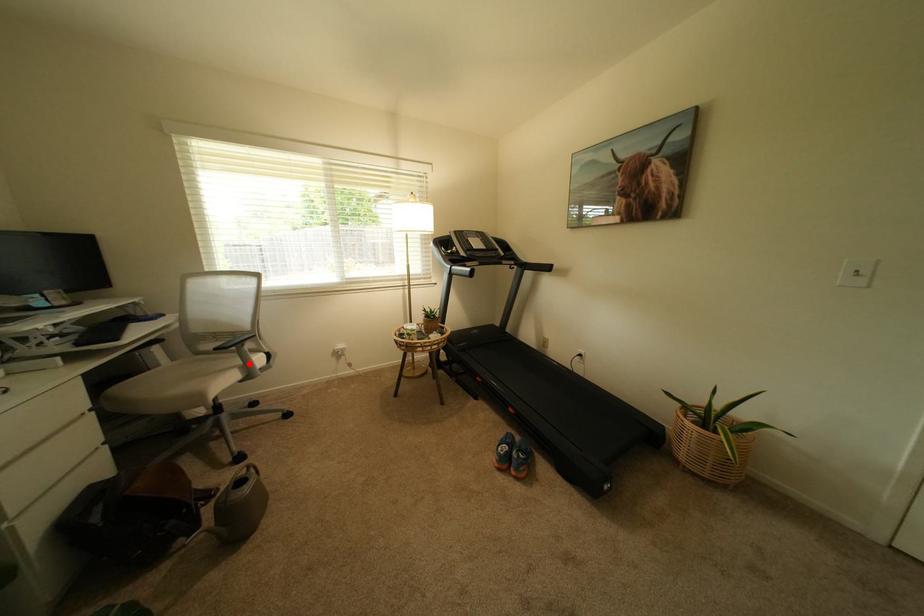
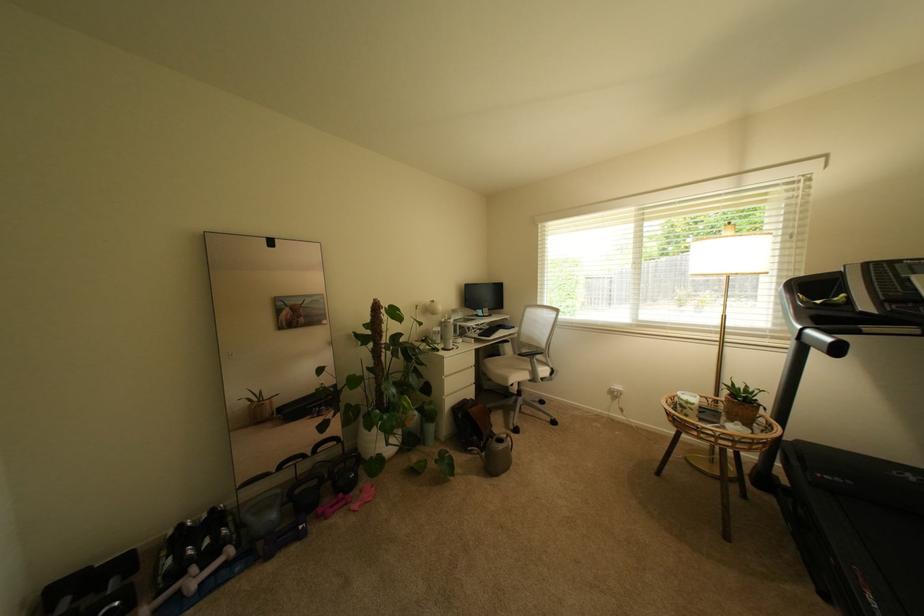
Find the pixel in the second image that matches the highlighted location in the first image.

(540, 370)